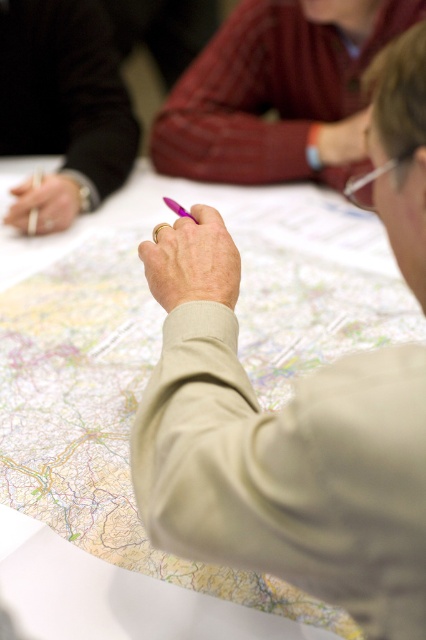
You are standing in front of the table where the map is laid out. There is a point marked at coordinates [279,92] on the map. What object or feature is located at this point?

The point at coordinates [279,92] on the map indicates the location of the matte red sweater at upper center.

From the picture: You are a participant in the meeting and need to make a note on the map. Can you reach the purple plastic pen at center without moving the beige paper map at center?

The beige paper map at center is above the purple plastic pen at center, so you cannot reach the purple plastic pen at center without moving the beige paper map at center first.